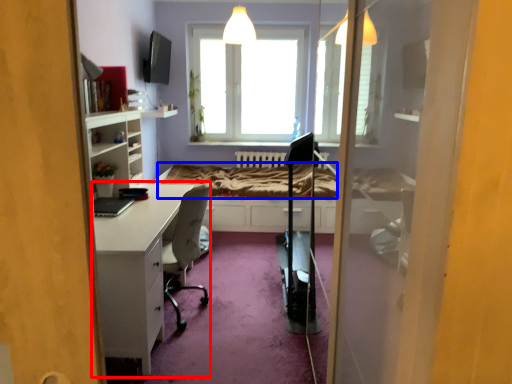
Question: Among these objects, which one is nearest to the camera, desk (highlighted by a red box) or bed frame (highlighted by a blue box)?

Choices:
 (A) desk
 (B) bed frame

Answer: (A)